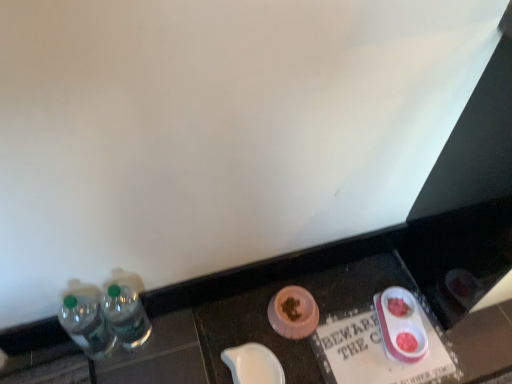
I want to click on vacant space in white paper sign at lower center (from a real-world perspective), so click(x=368, y=349).